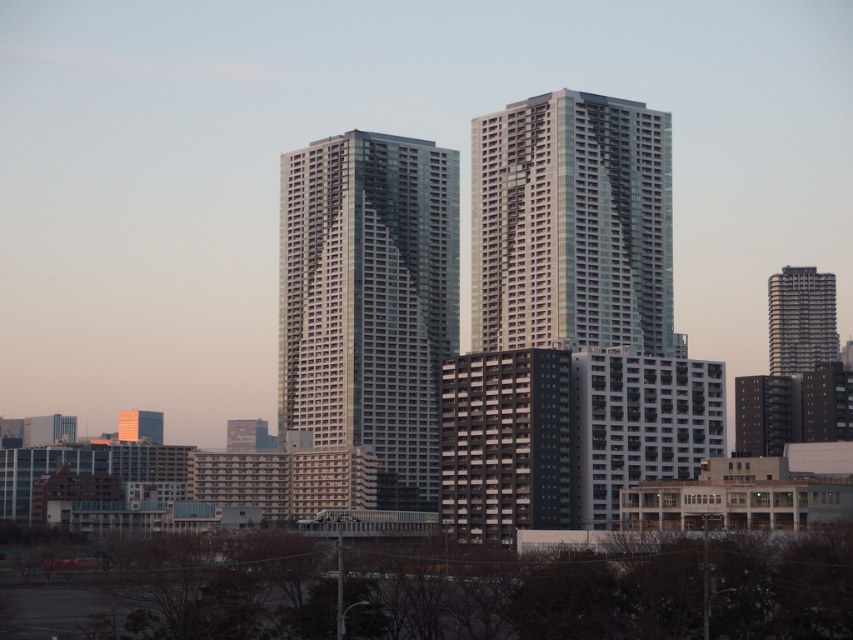
Question: Which of the following is the farthest from the observer?

Choices:
 (A) metallic silver building at right
 (B) glossy glass building at center

Answer: (A)

Question: Considering the real-world distances, which object is farthest from the glossy glass building at center?

Choices:
 (A) glassy metallic building at center
 (B) orange glass tower at lower left

Answer: (B)

Question: Is glossy glass building at center positioned at the back of metallic silver building at right?

Choices:
 (A) no
 (B) yes

Answer: (A)

Question: Does glassy metallic building at center appear under glossy glass building at center?

Choices:
 (A) yes
 (B) no

Answer: (A)

Question: Based on their relative distances, which object is nearer to the glassy metallic building at center?

Choices:
 (A) orange glass tower at lower left
 (B) glossy glass building at center
 (C) metallic silver building at right

Answer: (B)

Question: Is glossy glass building at center in front of metallic silver building at right?

Choices:
 (A) no
 (B) yes

Answer: (B)